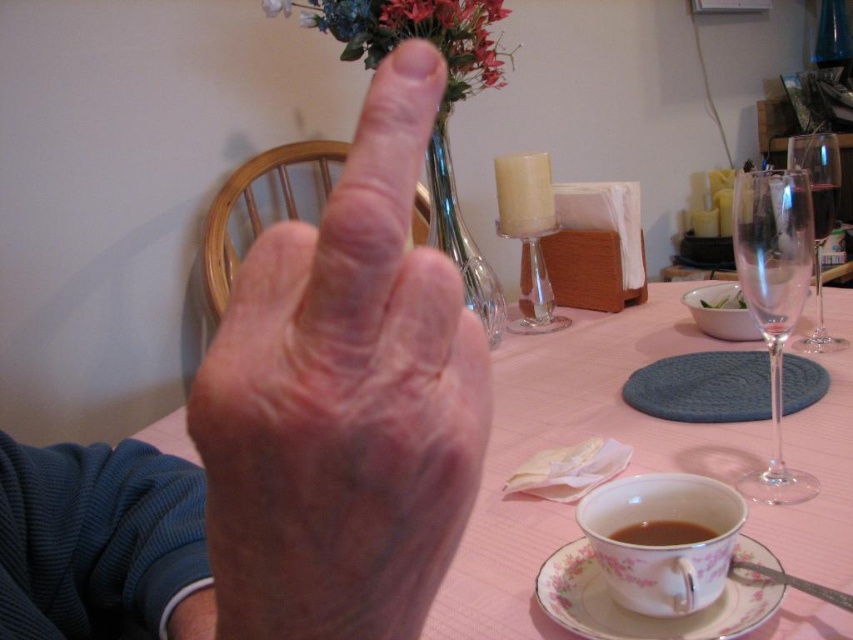
Between dry skin hand at center and brown matte cup at lower center, which one is positioned lower?

brown matte cup at lower center is lower down.

Measure the distance between point (193, 440) and camera.

Point (193, 440) and camera are 6.15 inches apart from each other.

The height and width of the screenshot is (640, 853). Find the location of `dry skin hand at center`. dry skin hand at center is located at coordinates (344, 401).

Does dry skin hand at center have a greater height compared to clear glass wine glass at right?

Incorrect, dry skin hand at center's height is not larger of clear glass wine glass at right's.

This screenshot has height=640, width=853. I want to click on dry skin hand at center, so click(344, 401).

Is point (396, 86) in front of point (563, 547)?

Yes, point (396, 86) is closer to viewer.

Does dry skin hand at center appear on the right side of porcelain floral saucer at lower center?

In fact, dry skin hand at center is to the left of porcelain floral saucer at lower center.

You are a GUI agent. You are given a task and a screenshot of the screen. Output one action in this format:
    pyautogui.click(x=<x>, y=<y>)
    Task: Click on the dry skin hand at center
    The width and height of the screenshot is (853, 640).
    Given the screenshot: What is the action you would take?
    pyautogui.click(x=344, y=401)